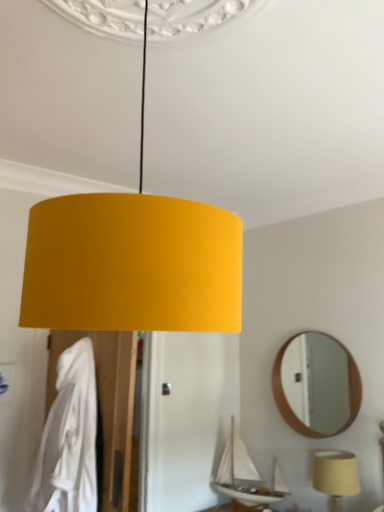
Question: Does white matte sailboat at lower center appear on the left side of matte beige lampshade at lower right?

Choices:
 (A) no
 (B) yes

Answer: (B)

Question: From a real-world perspective, is white matte sailboat at lower center positioned under matte beige lampshade at lower right based on gravity?

Choices:
 (A) no
 (B) yes

Answer: (A)

Question: Considering the relative positions of white matte sailboat at lower center and matte beige lampshade at lower right in the image provided, is white matte sailboat at lower center to the right of matte beige lampshade at lower right from the viewer's perspective?

Choices:
 (A) yes
 (B) no

Answer: (B)

Question: Can you confirm if white matte sailboat at lower center is thinner than matte beige lampshade at lower right?

Choices:
 (A) no
 (B) yes

Answer: (A)

Question: Is the depth of white matte sailboat at lower center greater than that of matte beige lampshade at lower right?

Choices:
 (A) no
 (B) yes

Answer: (B)

Question: Looking at their shapes, would you say wooden round mirror at upper right is wider or thinner than white fabric robe at left?

Choices:
 (A) wide
 (B) thin

Answer: (B)

Question: Considering their positions, is wooden round mirror at upper right located in front of or behind white fabric robe at left?

Choices:
 (A) front
 (B) behind

Answer: (B)

Question: Is wooden round mirror at upper right situated inside white fabric robe at left or outside?

Choices:
 (A) outside
 (B) inside

Answer: (A)

Question: Considering the positions of wooden round mirror at upper right and white fabric robe at left in the image, is wooden round mirror at upper right taller or shorter than white fabric robe at left?

Choices:
 (A) tall
 (B) short

Answer: (B)

Question: Is matte beige lampshade at lower right wider or thinner than wooden round mirror at upper right?

Choices:
 (A) wide
 (B) thin

Answer: (A)

Question: Looking at the image, does matte beige lampshade at lower right seem bigger or smaller compared to wooden round mirror at upper right?

Choices:
 (A) small
 (B) big

Answer: (A)

Question: Based on their positions, is matte beige lampshade at lower right located to the left or right of wooden round mirror at upper right?

Choices:
 (A) left
 (B) right

Answer: (B)

Question: Considering their positions, is matte beige lampshade at lower right located in front of or behind wooden round mirror at upper right?

Choices:
 (A) behind
 (B) front

Answer: (B)

Question: From their relative heights in the image, would you say white fabric robe at left is taller or shorter than wooden round mirror at upper right?

Choices:
 (A) tall
 (B) short

Answer: (A)

Question: From a real-world perspective, is white fabric robe at left positioned above or below wooden round mirror at upper right?

Choices:
 (A) below
 (B) above

Answer: (A)